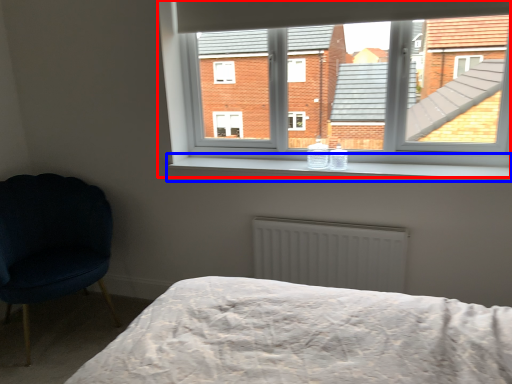
Question: Which object is further to the camera taking this photo, window (highlighted by a red box) or window sill (highlighted by a blue box)?

Choices:
 (A) window
 (B) window sill

Answer: (A)